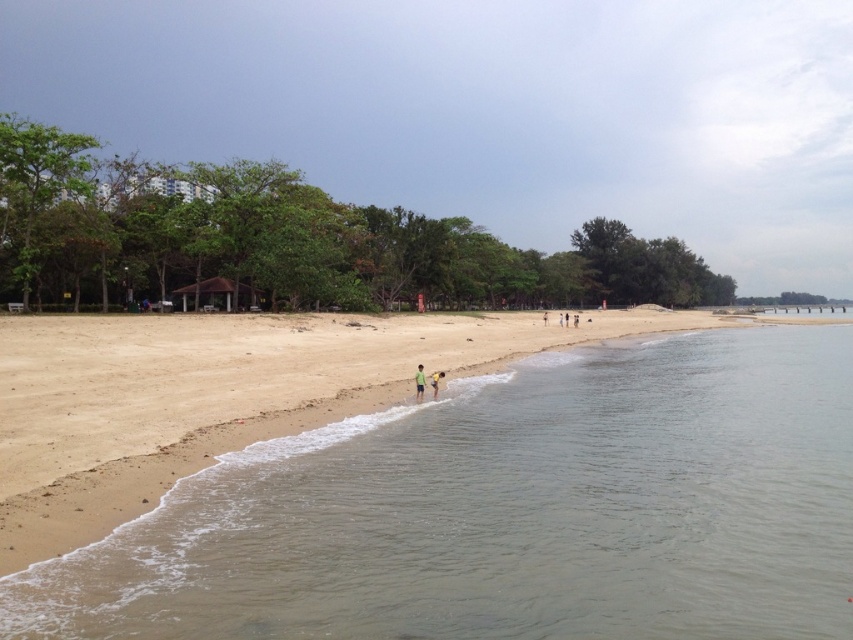
Is brown sand at lower left to the left of green matte shirt at center from the viewer's perspective?

In fact, brown sand at lower left is to the right of green matte shirt at center.

From the picture: Measure the distance between brown sand at lower left and camera.

brown sand at lower left is 21.36 feet away from camera.

Locate an element on the screen. The width and height of the screenshot is (853, 640). brown sand at lower left is located at coordinates (508, 512).

Who is more forward, [582,628] or [421,381]?

Positioned in front is point [582,628].

Describe the element at coordinates (508, 512) in the screenshot. I see `brown sand at lower left` at that location.

This screenshot has width=853, height=640. I want to click on brown sand at lower left, so click(508, 512).

Between yellow fabric at lower center and green matte shirt at center, which one is positioned higher?

green matte shirt at center is above.

Which is below, yellow fabric at lower center or green matte shirt at center?

yellow fabric at lower center

Where is `yellow fabric at lower center`? This screenshot has height=640, width=853. yellow fabric at lower center is located at coordinates (419, 381).